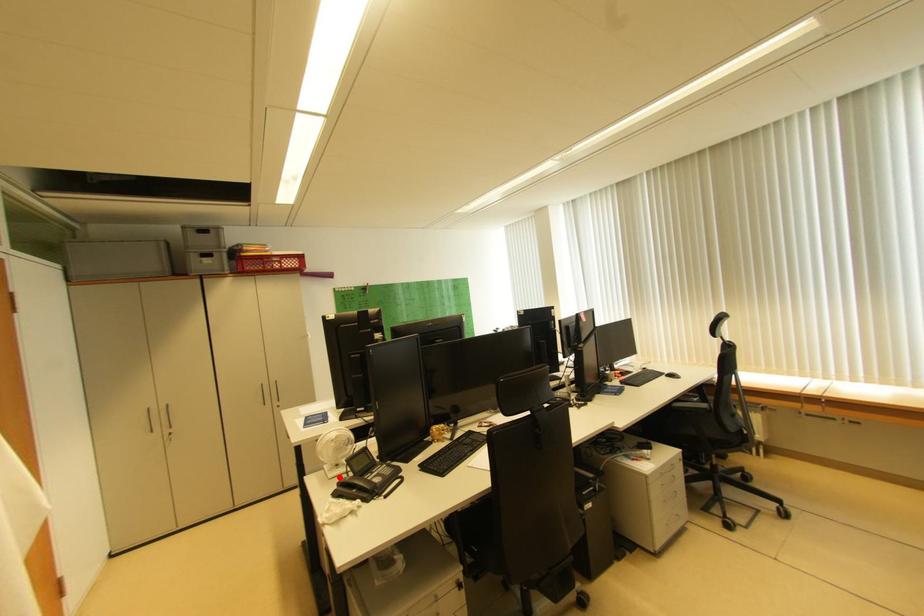
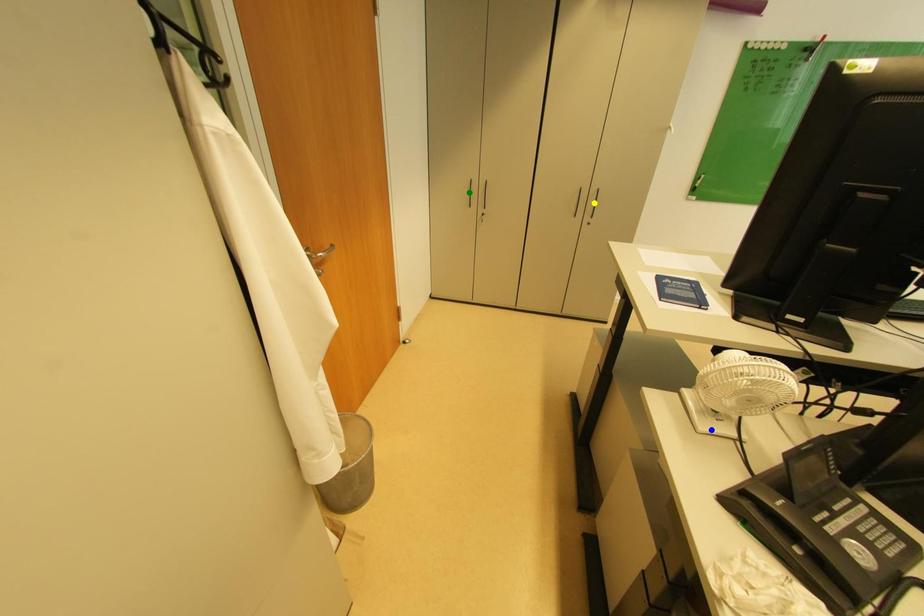
Question: I am providing you with two images of the same scene from different viewpoints. A red point is marked on the first image. You are given multiple points on the second image. Which spot in image 2 lines up with the point in image 1?

Choices:
 (A) blue point
 (B) green point
 (C) yellow point

Answer: (A)